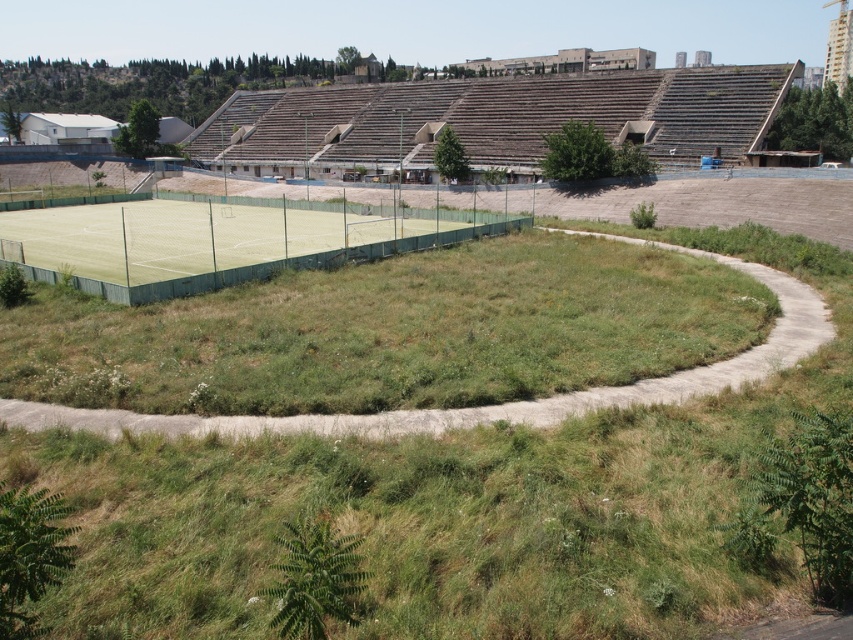
Does green grassy circle at center have a lesser height compared to green synthetic turf tennis court at center?

Yes, green grassy circle at center is shorter than green synthetic turf tennis court at center.

Does green grassy circle at center appear under green synthetic turf tennis court at center?

Yes, green grassy circle at center is below green synthetic turf tennis court at center.

Where is `green grassy circle at center`? The width and height of the screenshot is (853, 640). green grassy circle at center is located at coordinates (442, 516).

Identify the location of green grassy circle at center. (442, 516).

Can you confirm if green grassy circle at center is positioned to the right of brown wooden amphitheater at upper center?

Answer: Correct, you'll find green grassy circle at center to the right of brown wooden amphitheater at upper center.

In the scene shown: Is green grassy circle at center wider than brown wooden amphitheater at upper center?

No, green grassy circle at center is not wider than brown wooden amphitheater at upper center.

Between point (178, 592) and point (457, 97), which one is positioned in front?

Point (178, 592)

Where is `green grassy circle at center`? green grassy circle at center is located at coordinates (442, 516).

In the scene shown: Does brown wooden amphitheater at upper center have a greater height compared to green synthetic turf tennis court at center?

Correct, brown wooden amphitheater at upper center is much taller as green synthetic turf tennis court at center.

Identify the location of brown wooden amphitheater at upper center. The image size is (853, 640). (494, 120).

Identify the location of brown wooden amphitheater at upper center. (494, 120).

Locate an element on the screen. brown wooden amphitheater at upper center is located at coordinates (494, 120).